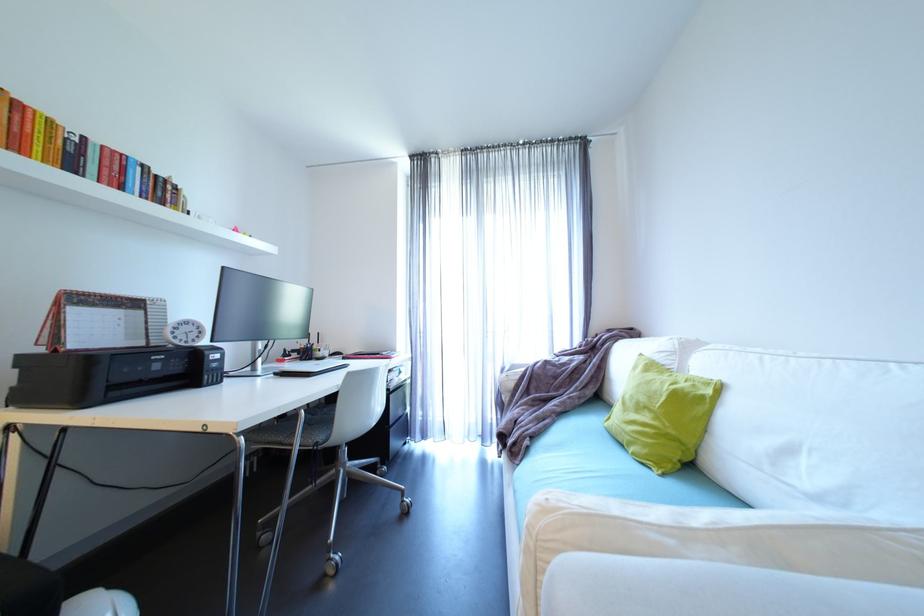
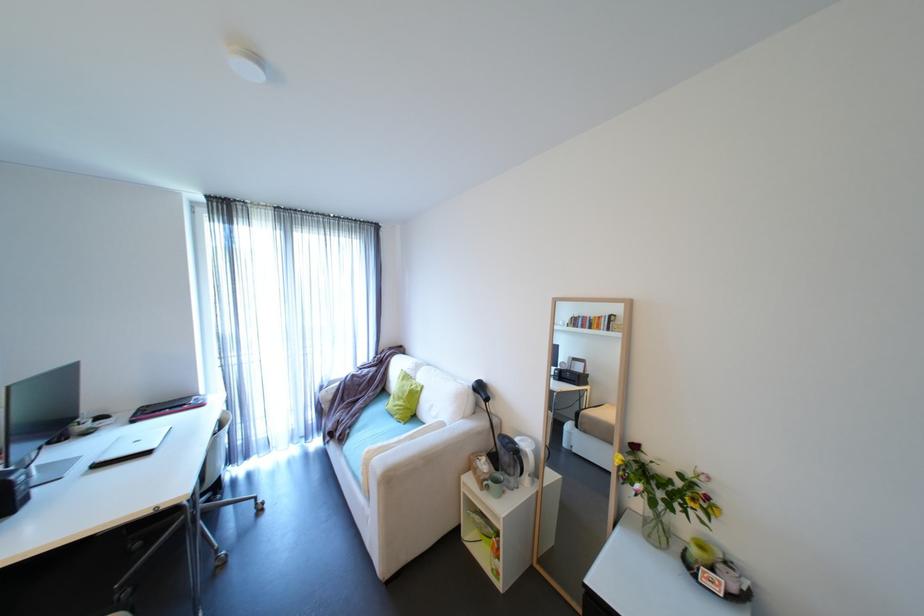
Where in the second image is the point corresponding to point 663,419 from the first image?

(411, 402)